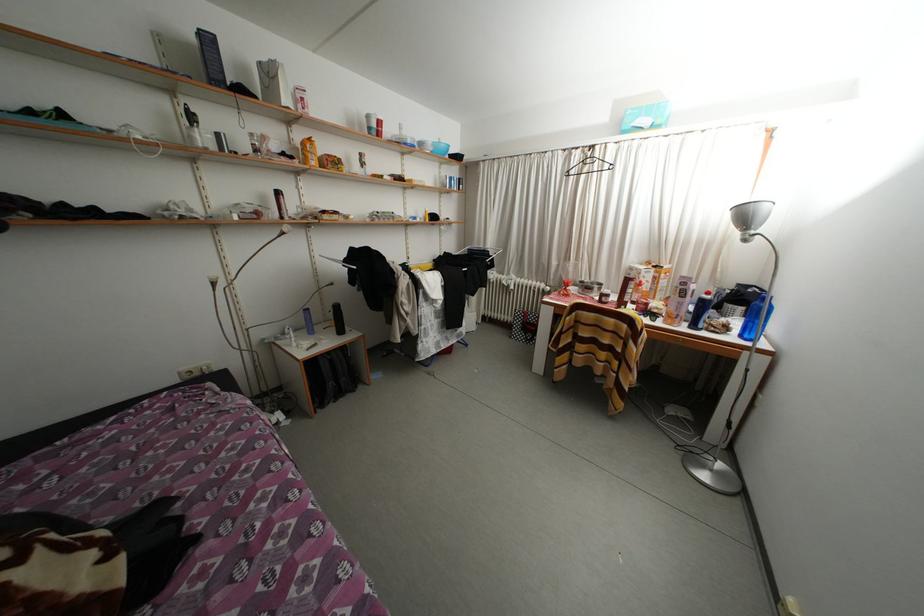
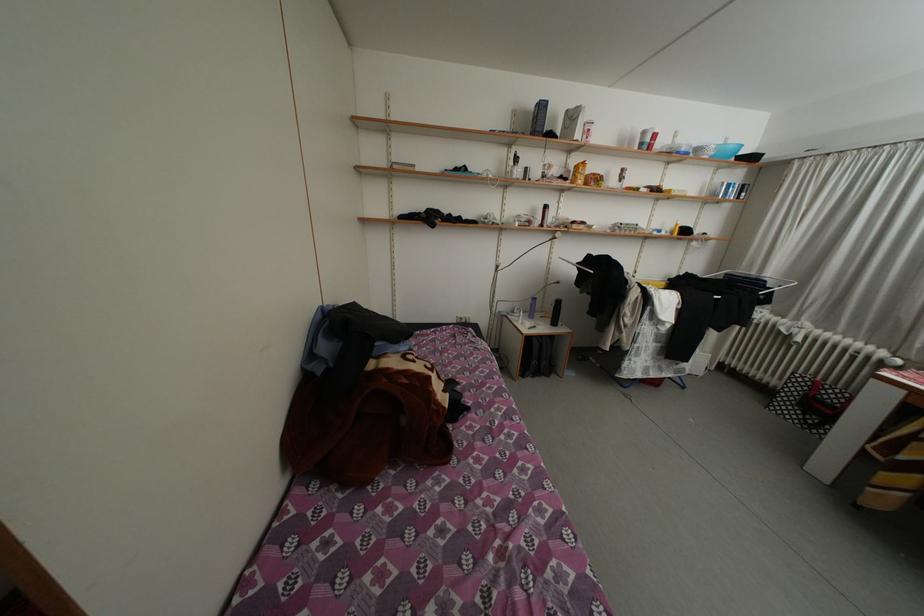
Where in the second image is the point corresponding to point 310,148 from the first image?

(584, 172)